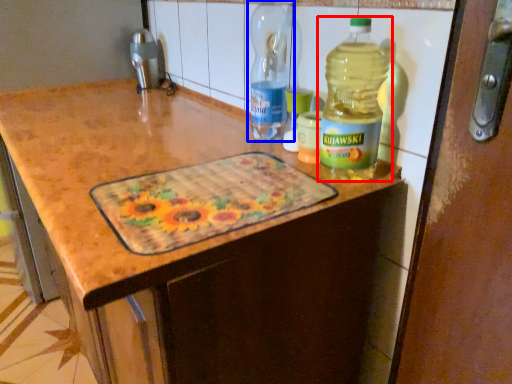
Question: Among these objects, which one is nearest to the camera, bottle (highlighted by a red box) or bottle (highlighted by a blue box)?

Choices:
 (A) bottle
 (B) bottle

Answer: (A)